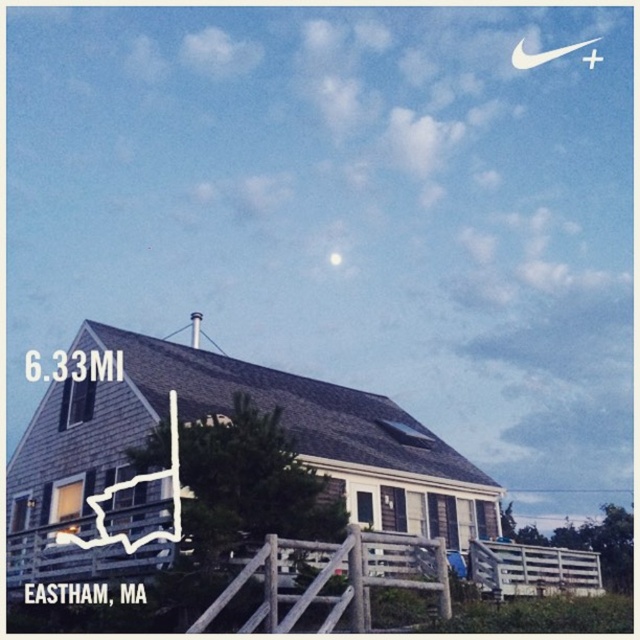
You are standing at the point marked by the coordinates point (x=586, y=44) and want to walk to the point marked by point (x=332, y=257). Given that the wooden fence is between you and your destination, can you reach your destination without crossing the fence?

Point (x=586, y=44) is behind point (x=332, y=257), so you are already behind the wooden fence which is between you and your destination. Therefore, you cannot reach point (x=332, y=257) without crossing the fence.

Consider the image. You are a painter standing at the base of the wooden fence in front of the house. You want to paint both the white fabric crescent at upper right and the bright silver moon at upper center. However, your easel can only hold one object in focus at a time. Which object should you focus on first if you want to paint them in the order they appear from left to right?

The bright silver moon at upper center should be painted first because it is positioned to the left of the white fabric crescent at upper right.

You are standing in front of the house and see the white fabric crescent at upper right. Where exactly is it located in relation to the house?

The white fabric crescent at upper right is located at point (541,54) relative to the house.